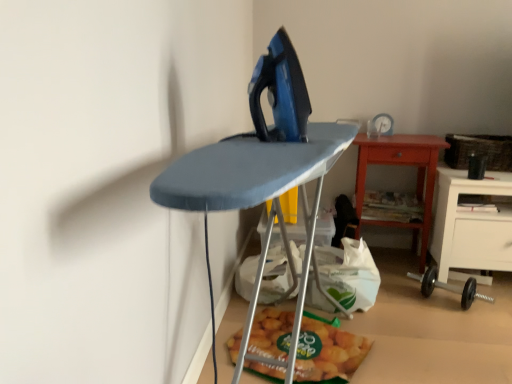
Question: Can you confirm if matte plastic bag of chips at lower center is positioned to the left of black rubber dumbbell at lower right?

Choices:
 (A) yes
 (B) no

Answer: (A)

Question: Is there a large distance between matte plastic bag of chips at lower center and black rubber dumbbell at lower right?

Choices:
 (A) no
 (B) yes

Answer: (A)

Question: From the image's perspective, is matte plastic bag of chips at lower center on top of black rubber dumbbell at lower right?

Choices:
 (A) no
 (B) yes

Answer: (A)

Question: From a real-world perspective, is matte plastic bag of chips at lower center below black rubber dumbbell at lower right?

Choices:
 (A) no
 (B) yes

Answer: (B)

Question: Can you confirm if matte plastic bag of chips at lower center is thinner than black rubber dumbbell at lower right?

Choices:
 (A) no
 (B) yes

Answer: (A)

Question: From a real-world perspective, is wooden table at center right positioned above or below woven brown basket at right?

Choices:
 (A) below
 (B) above

Answer: (A)

Question: Looking at the image, does wooden table at center right seem bigger or smaller compared to woven brown basket at right?

Choices:
 (A) small
 (B) big

Answer: (B)

Question: From their relative heights in the image, would you say wooden table at center right is taller or shorter than woven brown basket at right?

Choices:
 (A) tall
 (B) short

Answer: (A)

Question: Is wooden table at center right inside the boundaries of woven brown basket at right, or outside?

Choices:
 (A) inside
 (B) outside

Answer: (B)

Question: Is white plastic grocery bag at lower center taller or shorter than blue fabric ironing board at center?

Choices:
 (A) tall
 (B) short

Answer: (B)

Question: From a real-world perspective, is white plastic grocery bag at lower center positioned above or below blue fabric ironing board at center?

Choices:
 (A) below
 (B) above

Answer: (A)

Question: From the image's perspective, is white plastic grocery bag at lower center located above or below blue fabric ironing board at center?

Choices:
 (A) below
 (B) above

Answer: (A)

Question: Considering the positions of white plastic grocery bag at lower center and blue fabric ironing board at center in the image, is white plastic grocery bag at lower center wider or thinner than blue fabric ironing board at center?

Choices:
 (A) thin
 (B) wide

Answer: (A)

Question: Is blue fabric ironing board at center taller or shorter than black rubber dumbbell at lower right?

Choices:
 (A) short
 (B) tall

Answer: (B)

Question: From a real-world perspective, is blue fabric ironing board at center above or below black rubber dumbbell at lower right?

Choices:
 (A) above
 (B) below

Answer: (A)